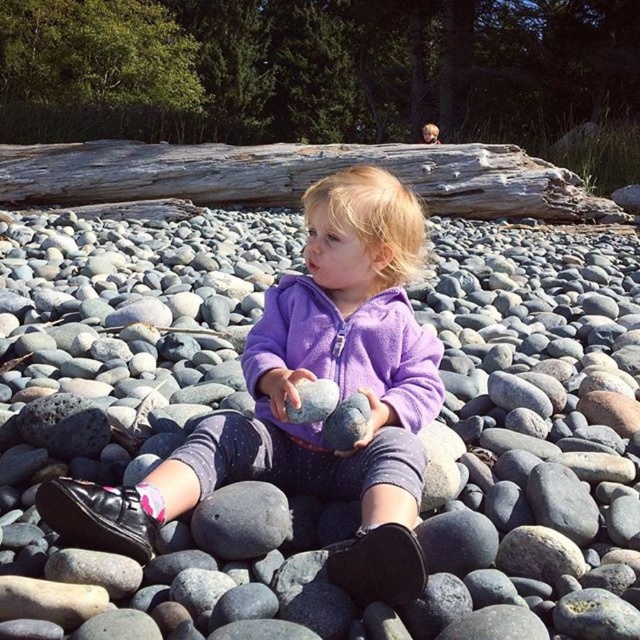
Question: Which object is closer to the camera taking this photo?

Choices:
 (A) smooth gray rock at center
 (B) weathered wood log at upper center

Answer: (A)

Question: Can you confirm if purple fleece jacket at center is positioned below smooth gray rock at center?

Choices:
 (A) yes
 (B) no

Answer: (B)

Question: Among these points, which one is nearest to the camera?

Choices:
 (A) (305, 180)
 (B) (278, 458)

Answer: (B)

Question: Considering the relative positions of purple fleece jacket at center and weathered wood log at upper center in the image provided, where is purple fleece jacket at center located with respect to weathered wood log at upper center?

Choices:
 (A) below
 (B) above

Answer: (A)

Question: Which object is farther from the camera taking this photo?

Choices:
 (A) purple fleece jacket at center
 (B) smooth gray rock at center
 (C) weathered wood log at upper center

Answer: (C)

Question: Does purple fleece jacket at center have a greater width compared to smooth gray rock at center?

Choices:
 (A) yes
 (B) no

Answer: (A)